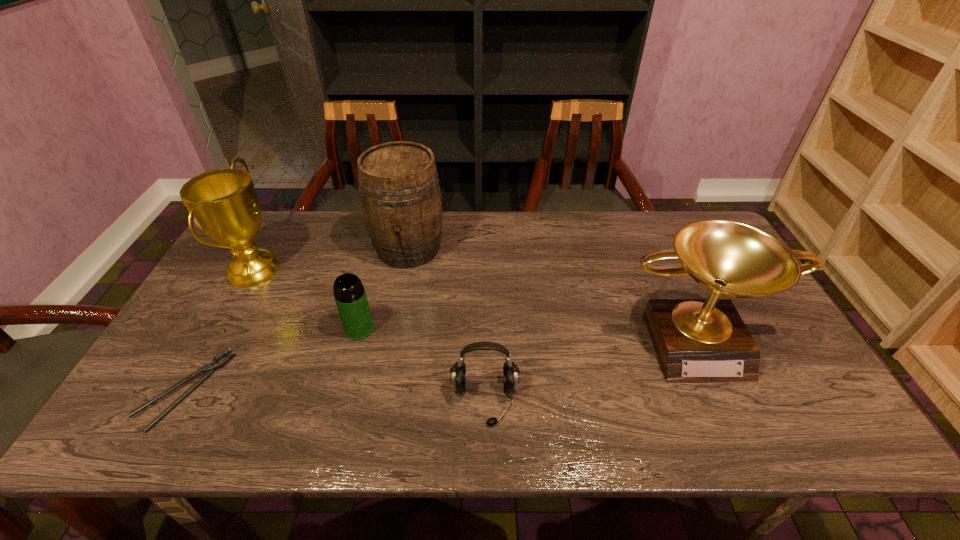
I want to click on object that is positioned at the near left corner, so click(x=210, y=368).

This screenshot has width=960, height=540. In order to click on free space at the far edge of the desktop in this screenshot , I will do `click(521, 214)`.

Where is `vacant region at the near edge of the desktop`? vacant region at the near edge of the desktop is located at coordinates (415, 431).

Identify the location of free region at the left edge of the desktop. This screenshot has width=960, height=540. (154, 378).

Identify the location of vacant position at the near left corner of the desktop. (152, 430).

Where is `empty space that is in between the shortest object and the third shortest object`? The image size is (960, 540). empty space that is in between the shortest object and the third shortest object is located at coordinates (273, 359).

Identify the location of empty space that is in between the fifth tallest object and the fourth tallest object. The width and height of the screenshot is (960, 540). (422, 365).

At what (x,y) coordinates should I click in order to perform the action: click on blank region between the second shortest object and the thermos bottle. Please return your answer as a coordinate pair (x, y). Looking at the image, I should click on (422, 365).

At what (x,y) coordinates should I click in order to perform the action: click on free space between the right award and the shortest object. Please return your answer as a coordinate pair (x, y). The image size is (960, 540). Looking at the image, I should click on (440, 364).

Where is `vacant space that is in between the tongs and the second object from right to left`? The image size is (960, 540). vacant space that is in between the tongs and the second object from right to left is located at coordinates (335, 395).